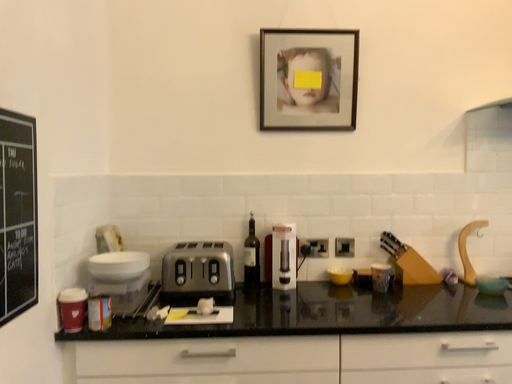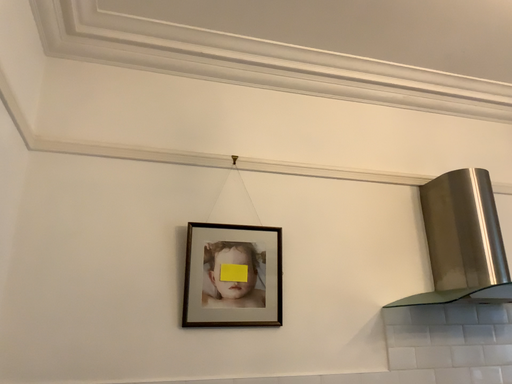
Question: Which way did the camera rotate in the video?

Choices:
 (A) rotated left
 (B) rotated right

Answer: (B)